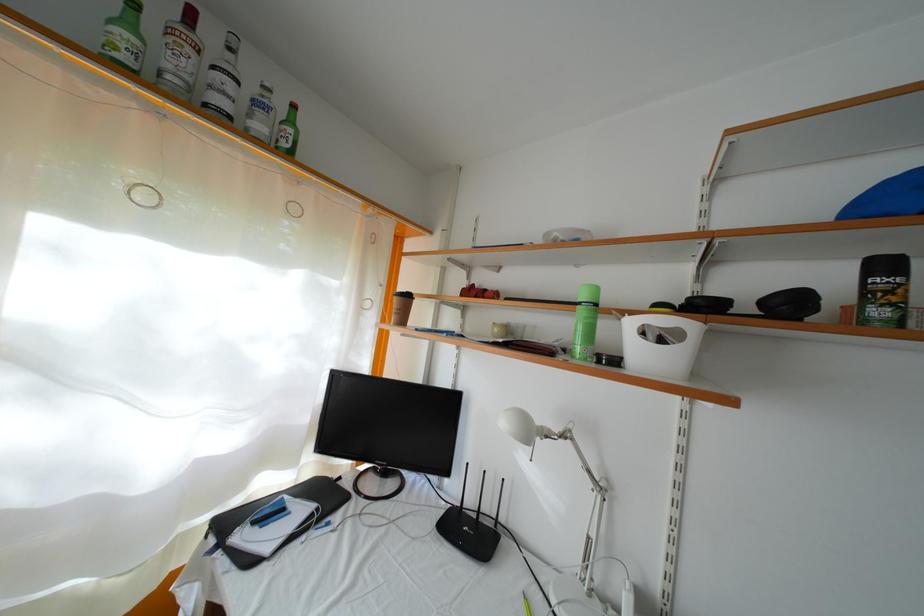
The image size is (924, 616). Find the location of `white lamp head`. white lamp head is located at coordinates (586, 468).